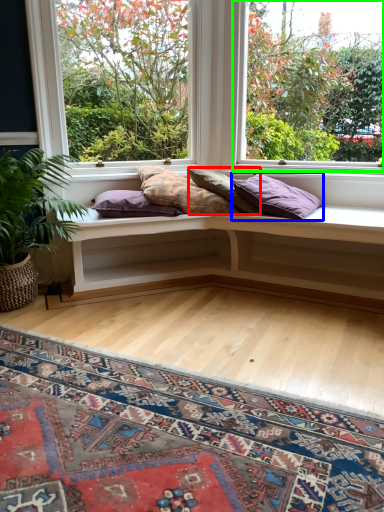
Question: Which object is the closest to the pillow (highlighted by a red box)? Choose among these: pillow (highlighted by a blue box) or window (highlighted by a green box).

Choices:
 (A) pillow
 (B) window

Answer: (A)